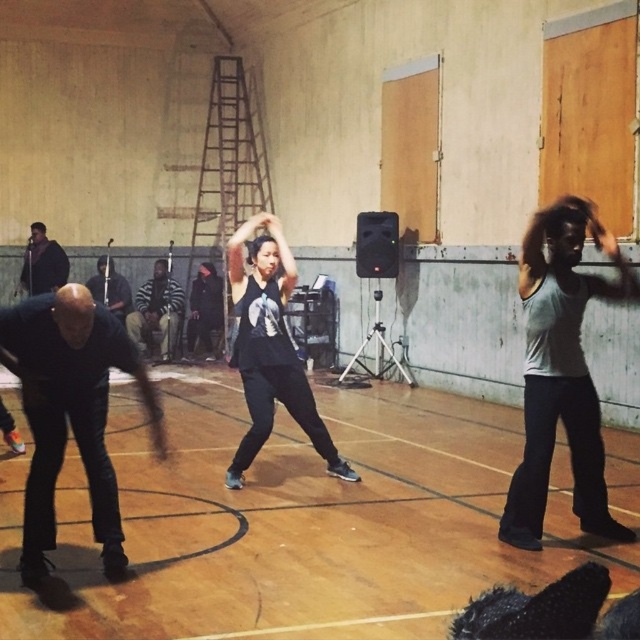
You are a photographer setting up for a dance class photo shoot in the gymnasium. You have two props to place near the dancers. The first prop is a black matte tank top at center, and the second is a dark brown leather jacket at left. Based on their sizes, which prop should you choose to ensure it stands out more in the photo?

The black matte tank top at center has a larger size compared to the dark brown leather jacket at left, so it will stand out more in the photo.

You are a photographer standing at the entrance of the gymnasium. You want to take a photo of the black matte tank top at center and the wooden floor at center. Which object should you focus on first if you want to capture both in the same frame without moving your camera?

The wooden floor at center is positioned on the right side of the black matte tank top at center, so you should focus on the black matte tank top at center first to ensure both are in frame without moving the camera.